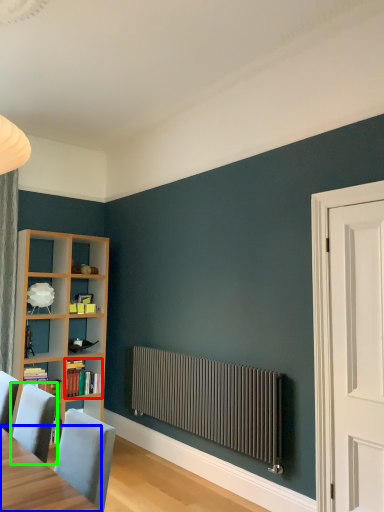
Question: Which object is the closest to the book (highlighted by a red box)? Choose among these: table (highlighted by a blue box) or chair (highlighted by a green box).

Choices:
 (A) table
 (B) chair

Answer: (B)